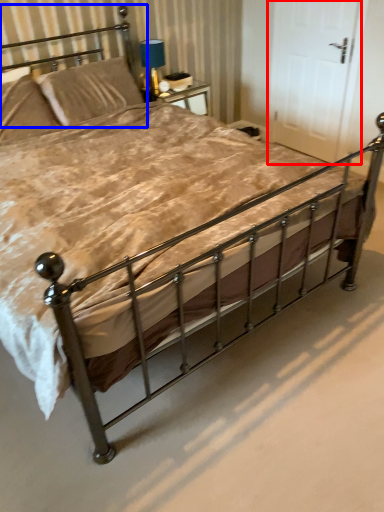
Question: Among these objects, which one is nearest to the camera, door (highlighted by a red box) or headboard (highlighted by a blue box)?

Choices:
 (A) door
 (B) headboard

Answer: (B)